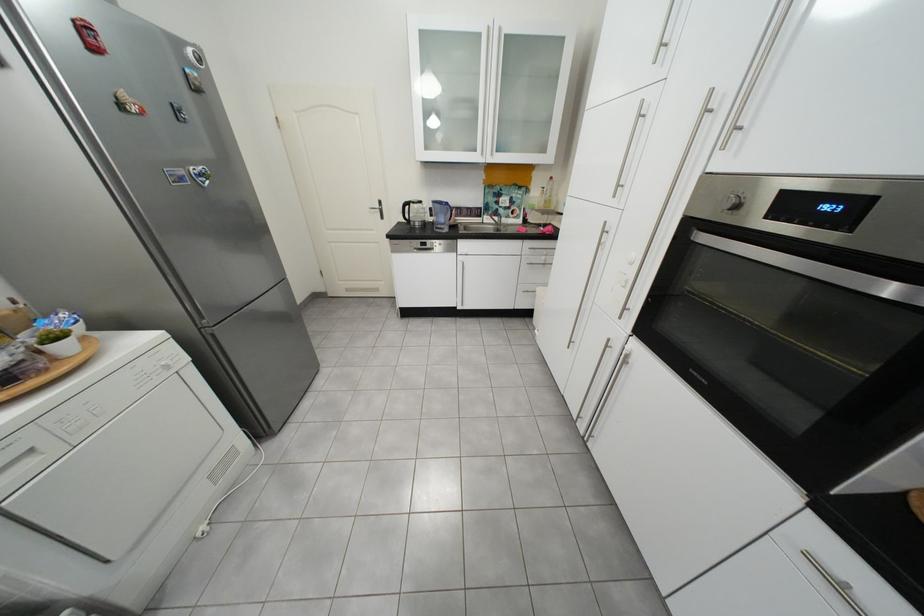
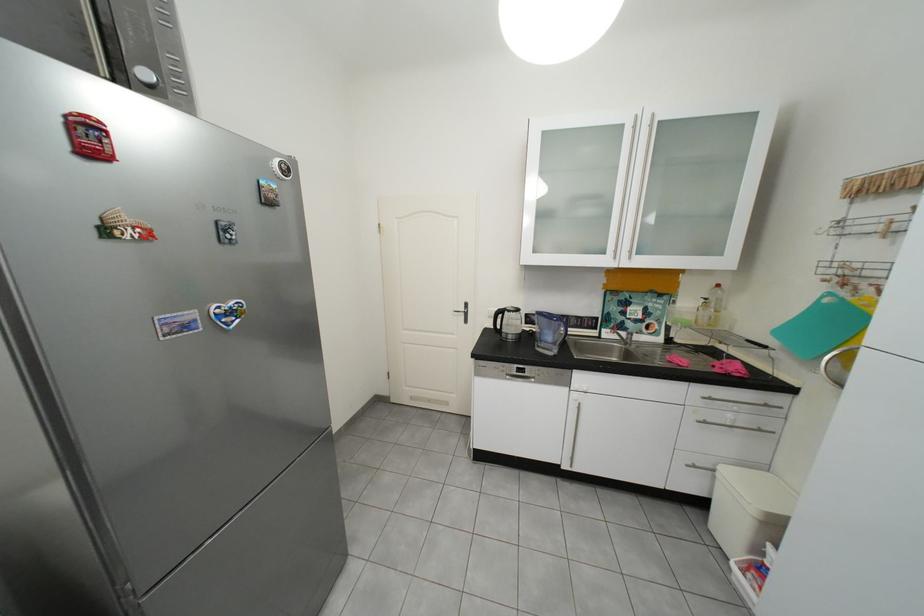
The first image is from the beginning of the video and the second image is from the end. How did the camera likely rotate when shooting the video?

The camera's rotation is toward left-up.